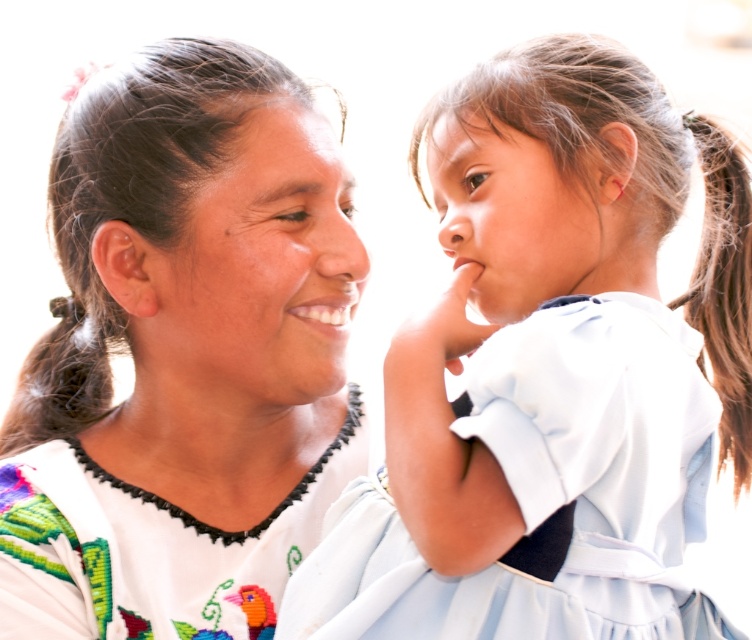
Who is higher up, light blue fabric dress at upper right or white embroidered dress at center?

light blue fabric dress at upper right is above.

Does point (569, 160) come closer to viewer compared to point (135, 536)?

Yes, point (569, 160) is closer to viewer.

Who is more distant from viewer, [602,250] or [199,522]?

The point [199,522] is more distant.

What are the coordinates of `light blue fabric dress at upper right` in the screenshot? It's located at (593, 196).

Can you confirm if white embroidered blouse at center is positioned to the left of white embroidered dress at center?

Correct, you'll find white embroidered blouse at center to the left of white embroidered dress at center.

Looking at this image, can you confirm if white embroidered blouse at center is positioned below white embroidered dress at center?

No, white embroidered blouse at center is not below white embroidered dress at center.

Between point (102, 538) and point (41, 465), which one is positioned in front?

Point (102, 538)

This screenshot has height=640, width=752. What are the coordinates of `white embroidered blouse at center` in the screenshot? It's located at pyautogui.click(x=183, y=355).

The height and width of the screenshot is (640, 752). What do you see at coordinates (547, 493) in the screenshot? I see `light blue fabric dress at center` at bounding box center [547, 493].

Between light blue fabric dress at center and white embroidered dress at center, which one has less height?

Standing shorter between the two is white embroidered dress at center.

What do you see at coordinates (547, 493) in the screenshot? I see `light blue fabric dress at center` at bounding box center [547, 493].

Locate an element on the screen. This screenshot has height=640, width=752. light blue fabric dress at center is located at coordinates (547, 493).